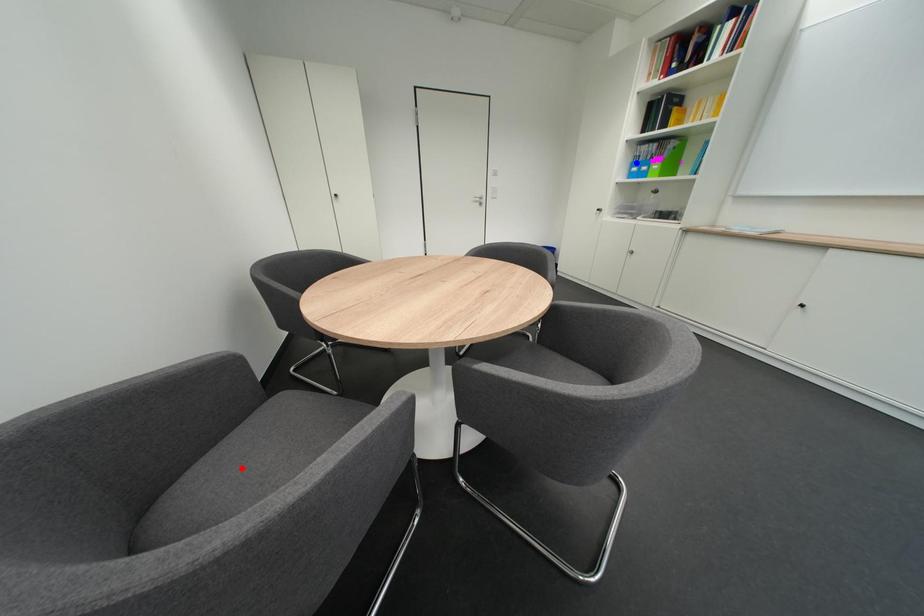
Question: Which of the two points in the image is closer to the camera?

Choices:
 (A) Blue point is closer.
 (B) Red point is closer.

Answer: (B)